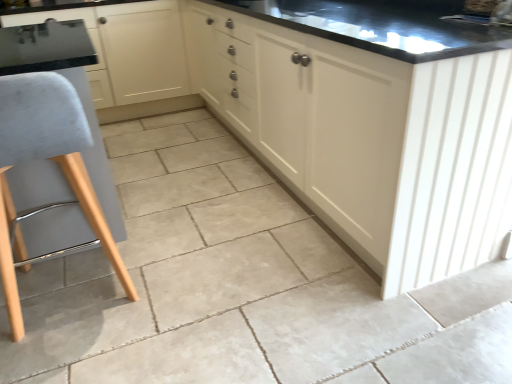
Find the location of a particular element. matte black sink at upper center is located at coordinates (484, 13).

Describe the element at coordinates (45, 158) in the screenshot. I see `light gray fabric stool at left` at that location.

Describe the element at coordinates (131, 57) in the screenshot. I see `matte white cabinet at center, which ranks as the 2th cabinetry in right-to-left order` at that location.

At what (x,y) coordinates should I click in order to perform the action: click on matte black sink at upper center. Please return your answer as a coordinate pair (x, y). This screenshot has width=512, height=384. Looking at the image, I should click on (484, 13).

From a real-world perspective, relative to matte white cabinet at center, the 1th cabinetry viewed from the left, is matte cream cabinet at center, arranged as the 1th cabinetry when viewed from the right, vertically above or below?

matte cream cabinet at center, arranged as the 1th cabinetry when viewed from the right, is situated higher than matte white cabinet at center, the 1th cabinetry viewed from the left, in the real world.

Between matte cream cabinet at center, arranged as the 1th cabinetry when viewed from the right, and matte white cabinet at center, the 1th cabinetry viewed from the left, which one has smaller width?

matte white cabinet at center, the 1th cabinetry viewed from the left, is thinner.

Is matte cream cabinet at center, which ranks as the 2th cabinetry in left-to-right order, positioned with its back to matte white cabinet at center, which ranks as the 2th cabinetry in right-to-left order?

No, matte cream cabinet at center, which ranks as the 2th cabinetry in left-to-right order, is not facing away from matte white cabinet at center, which ranks as the 2th cabinetry in right-to-left order.

Does point (382, 196) lie behind point (20, 242)?

No.

From the image's perspective, which one is positioned higher, matte cream cabinet at center, arranged as the 1th cabinetry when viewed from the right, or light gray fabric stool at left?

From the image's view, matte cream cabinet at center, arranged as the 1th cabinetry when viewed from the right, is above.

Looking at this image, is matte cream cabinet at center, arranged as the 1th cabinetry when viewed from the right, turned away from light gray fabric stool at left?

matte cream cabinet at center, arranged as the 1th cabinetry when viewed from the right, does not have its back to light gray fabric stool at left.

Which object is thinner, matte cream cabinet at center, arranged as the 1th cabinetry when viewed from the right, or light gray fabric stool at left?

light gray fabric stool at left.

Does matte white cabinet at center, which ranks as the 2th cabinetry in right-to-left order, appear on the right side of matte black sink at upper center?

No, matte white cabinet at center, which ranks as the 2th cabinetry in right-to-left order, is not to the right of matte black sink at upper center.

Is matte white cabinet at center, which ranks as the 2th cabinetry in right-to-left order, facing towards matte black sink at upper center?

Yes, matte white cabinet at center, which ranks as the 2th cabinetry in right-to-left order, faces towards matte black sink at upper center.

Which object is closer to the camera, matte white cabinet at center, which ranks as the 2th cabinetry in right-to-left order, or matte black sink at upper center?

matte black sink at upper center is closer to the camera.

Is matte white cabinet at center, the 1th cabinetry viewed from the left, situated inside matte black sink at upper center or outside?

matte white cabinet at center, the 1th cabinetry viewed from the left, is outside matte black sink at upper center.

Is point (87, 16) closer to camera compared to point (101, 220)?

No, it is not.

In terms of height, does matte white cabinet at center, which ranks as the 2th cabinetry in right-to-left order, look taller or shorter compared to light gray fabric stool at left?

Considering their sizes, matte white cabinet at center, which ranks as the 2th cabinetry in right-to-left order, has more height than light gray fabric stool at left.

Which object is positioned more to the left, matte white cabinet at center, which ranks as the 2th cabinetry in right-to-left order, or light gray fabric stool at left?

matte white cabinet at center, which ranks as the 2th cabinetry in right-to-left order.

Are matte white cabinet at center, the 1th cabinetry viewed from the left, and light gray fabric stool at left making contact?

→ matte white cabinet at center, the 1th cabinetry viewed from the left, and light gray fabric stool at left are clearly separated.

Is the depth of matte cream cabinet at center, which ranks as the 2th cabinetry in left-to-right order, less than that of matte black sink at upper center?

Yes, matte cream cabinet at center, which ranks as the 2th cabinetry in left-to-right order, is closer to the camera.

Is matte cream cabinet at center, arranged as the 1th cabinetry when viewed from the right, turned away from matte black sink at upper center?

Yes, matte black sink at upper center is at the back of matte cream cabinet at center, arranged as the 1th cabinetry when viewed from the right.

Is point (328, 159) closer to camera compared to point (483, 23)?

No, it is not.

The image size is (512, 384). I want to click on cabinetry that appears on the left of matte cream cabinet at center, arranged as the 1th cabinetry when viewed from the right, so click(131, 57).

From the image's perspective, is matte white cabinet at center, the 1th cabinetry viewed from the left, located beneath matte cream cabinet at center, arranged as the 1th cabinetry when viewed from the right?

No, from the image's perspective, matte white cabinet at center, the 1th cabinetry viewed from the left, is not below matte cream cabinet at center, arranged as the 1th cabinetry when viewed from the right.

Is matte white cabinet at center, which ranks as the 2th cabinetry in right-to-left order, taller or shorter than matte cream cabinet at center, arranged as the 1th cabinetry when viewed from the right?

matte white cabinet at center, which ranks as the 2th cabinetry in right-to-left order, is shorter than matte cream cabinet at center, arranged as the 1th cabinetry when viewed from the right.

From a real-world perspective, between matte black sink at upper center and light gray fabric stool at left, who is vertically lower?

light gray fabric stool at left.

Are matte black sink at upper center and light gray fabric stool at left located far from each other?

Yes.

Where is `cabinetry that appears on the left of matte cream cabinet at center, which ranks as the 2th cabinetry in left-to-right order`? cabinetry that appears on the left of matte cream cabinet at center, which ranks as the 2th cabinetry in left-to-right order is located at coordinates (131, 57).

Image resolution: width=512 pixels, height=384 pixels. Find the location of `furniture in front of the matte cream cabinet at center, arranged as the 1th cabinetry when viewed from the right`. furniture in front of the matte cream cabinet at center, arranged as the 1th cabinetry when viewed from the right is located at coordinates (45, 158).

Considering their positions, is light gray fabric stool at left positioned closer to matte black sink at upper center than matte cream cabinet at center, arranged as the 1th cabinetry when viewed from the right?

matte cream cabinet at center, arranged as the 1th cabinetry when viewed from the right.

From the image, which object appears to be nearer to light gray fabric stool at left, matte black sink at upper center or matte white cabinet at center, which ranks as the 2th cabinetry in right-to-left order?

Based on the image, matte black sink at upper center appears to be nearer to light gray fabric stool at left.

Considering their positions, is matte cream cabinet at center, which ranks as the 2th cabinetry in left-to-right order, positioned further to light gray fabric stool at left than matte white cabinet at center, the 1th cabinetry viewed from the left?

matte white cabinet at center, the 1th cabinetry viewed from the left.

Which object lies further to the anchor point matte black sink at upper center, matte white cabinet at center, the 1th cabinetry viewed from the left, or light gray fabric stool at left?

matte white cabinet at center, the 1th cabinetry viewed from the left.

From the picture: From the image, which object appears to be farther from light gray fabric stool at left, matte cream cabinet at center, arranged as the 1th cabinetry when viewed from the right, or matte black sink at upper center?

Based on the image, matte black sink at upper center appears to be further to light gray fabric stool at left.

Considering their positions, is matte black sink at upper center positioned closer to matte white cabinet at center, the 1th cabinetry viewed from the left, than light gray fabric stool at left?

Among the two, light gray fabric stool at left is located nearer to matte white cabinet at center, the 1th cabinetry viewed from the left.

In the scene shown: From the image, which object appears to be nearer to matte black sink at upper center, matte white cabinet at center, the 1th cabinetry viewed from the left, or matte cream cabinet at center, arranged as the 1th cabinetry when viewed from the right?

Among the two, matte cream cabinet at center, arranged as the 1th cabinetry when viewed from the right, is located nearer to matte black sink at upper center.

Which object lies nearer to the anchor point matte cream cabinet at center, arranged as the 1th cabinetry when viewed from the right, light gray fabric stool at left or matte black sink at upper center?

matte black sink at upper center is positioned closer to the anchor matte cream cabinet at center, arranged as the 1th cabinetry when viewed from the right.

I want to click on furniture between matte white cabinet at center, which ranks as the 2th cabinetry in right-to-left order, and matte black sink at upper center, in the horizontal direction, so click(x=45, y=158).

Locate an element on the screen. cabinetry positioned between light gray fabric stool at left and matte white cabinet at center, the 1th cabinetry viewed from the left, from near to far is located at coordinates (310, 117).

Locate an element on the screen. This screenshot has height=384, width=512. cabinetry between matte white cabinet at center, which ranks as the 2th cabinetry in right-to-left order, and matte black sink at upper center, in the horizontal direction is located at coordinates (310, 117).

Find the location of a particular element. This screenshot has height=384, width=512. cabinetry between light gray fabric stool at left and matte black sink at upper center is located at coordinates (310, 117).